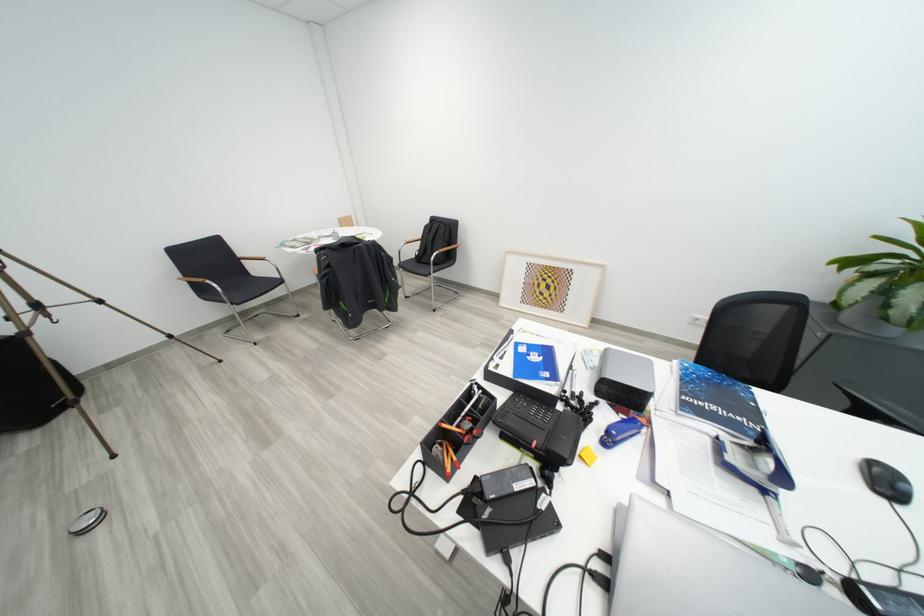
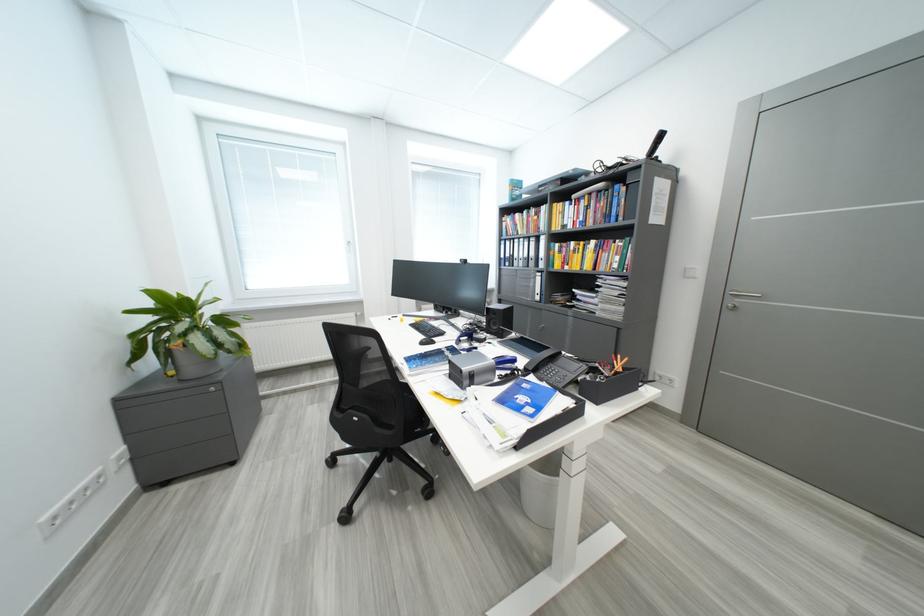
Where in the second image is the point corresponding to point (884, 270) from the first image?

(189, 331)